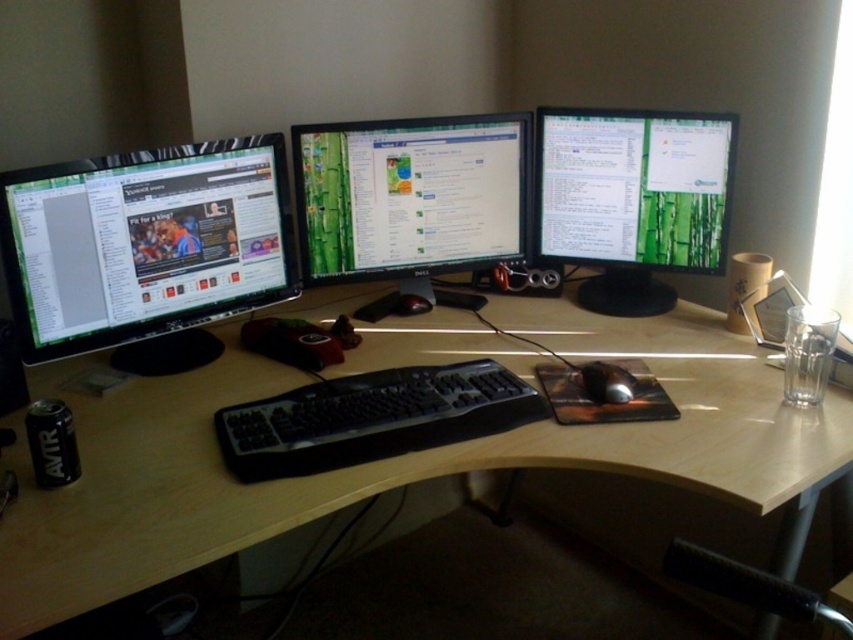
Between matte black monitor at left and green matte monitor at center, which one appears on the left side from the viewer's perspective?

matte black monitor at left

Is point (109, 196) positioned in front of point (492, 189)?

That is True.

Which is in front, point (263, 177) or point (521, 125)?

Point (263, 177) is more forward.

Where is `matte black monitor at left`? This screenshot has height=640, width=853. matte black monitor at left is located at coordinates [144, 248].

Which of these two, light wood computer desk at center or green matte monitor at center, stands shorter?

green matte monitor at center

Is point (193, 417) behind point (318, 138)?

No, it is in front of (318, 138).

The image size is (853, 640). Describe the element at coordinates (392, 458) in the screenshot. I see `light wood computer desk at center` at that location.

What are the coordinates of `light wood computer desk at center` in the screenshot? It's located at (392, 458).

Does point (849, 401) come farther from viewer compared to point (654, 122)?

That is False.

Is point (16, 465) closer to viewer compared to point (689, 134)?

That is True.

The width and height of the screenshot is (853, 640). Identify the location of light wood computer desk at center. (392, 458).